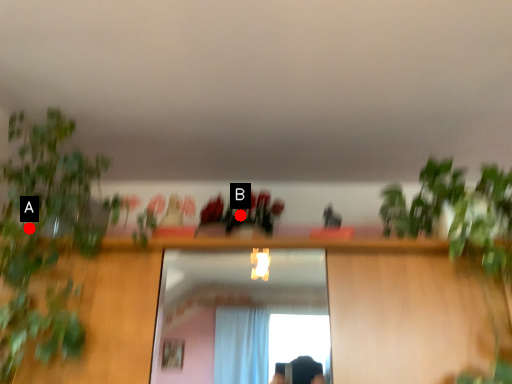
Question: Two points are circled on the image, labeled by A and B beside each circle. Which point appears closest to the camera in this image?

Choices:
 (A) A is closer
 (B) B is closer

Answer: (A)